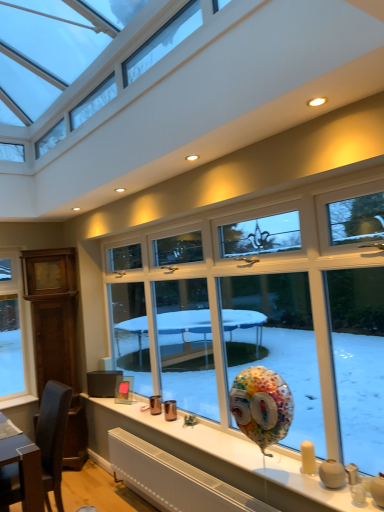
Question: Can you confirm if yellow matte candle at lower right is shorter than matte white vase at lower right?

Choices:
 (A) no
 (B) yes

Answer: (A)

Question: Is yellow matte candle at lower right oriented towards matte white vase at lower right?

Choices:
 (A) yes
 (B) no

Answer: (B)

Question: Considering the relative sizes of yellow matte candle at lower right and matte white vase at lower right in the image provided, is yellow matte candle at lower right wider than matte white vase at lower right?

Choices:
 (A) no
 (B) yes

Answer: (A)

Question: Is yellow matte candle at lower right turned away from matte white vase at lower right?

Choices:
 (A) yes
 (B) no

Answer: (B)

Question: Is yellow matte candle at lower right positioned in front of matte white vase at lower right?

Choices:
 (A) no
 (B) yes

Answer: (A)

Question: Is yellow matte candle at lower right smaller than matte white vase at lower right?

Choices:
 (A) yes
 (B) no

Answer: (A)

Question: Is matte white vase at lower right oriented away from yellow matte candle at lower right?

Choices:
 (A) no
 (B) yes

Answer: (A)

Question: From a real-world perspective, is matte white vase at lower right physically below yellow matte candle at lower right?

Choices:
 (A) yes
 (B) no

Answer: (A)

Question: From the image's perspective, would you say matte white vase at lower right is positioned over yellow matte candle at lower right?

Choices:
 (A) no
 (B) yes

Answer: (A)

Question: Is matte white vase at lower right not inside yellow matte candle at lower right?

Choices:
 (A) no
 (B) yes

Answer: (B)

Question: Considering the relative positions of matte white vase at lower right and yellow matte candle at lower right in the image provided, is matte white vase at lower right in front of yellow matte candle at lower right?

Choices:
 (A) no
 (B) yes

Answer: (B)

Question: From a real-world perspective, is matte white vase at lower right physically above yellow matte candle at lower right?

Choices:
 (A) no
 (B) yes

Answer: (A)

Question: Is point (332, 472) positioned closer to the camera than point (307, 453)?

Choices:
 (A) farther
 (B) closer

Answer: (B)